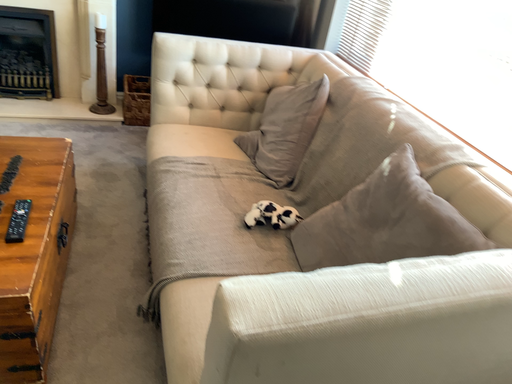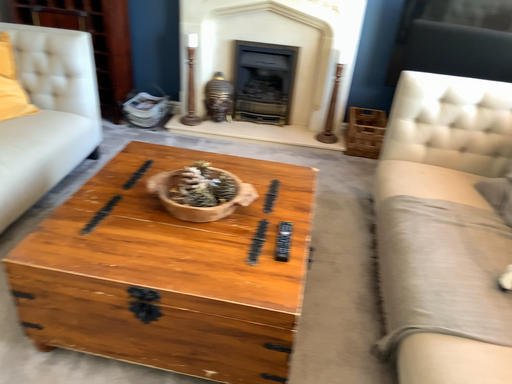
Question: Which way did the camera rotate in the video?

Choices:
 (A) rotated left
 (B) rotated right

Answer: (A)